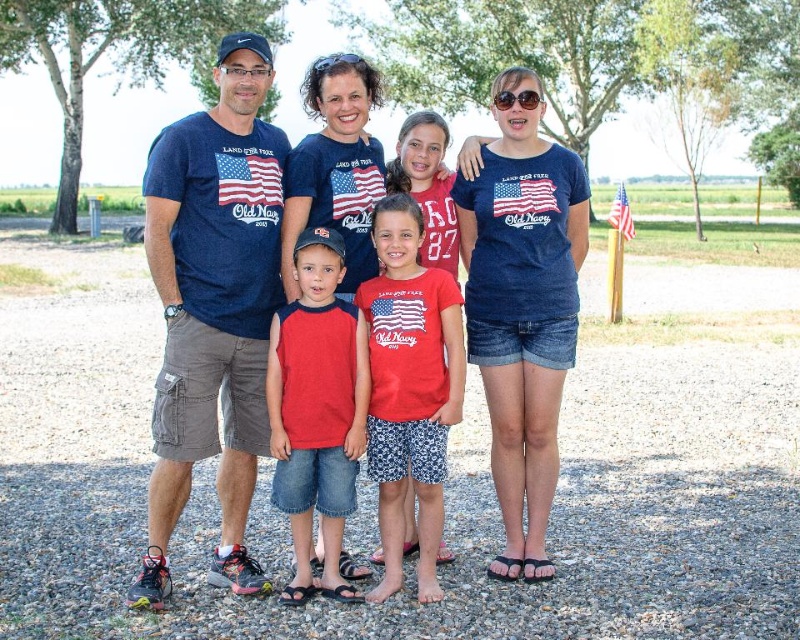
You are a photographer trying to capture a clear shot of the red cotton shirt at center and the american flag at center. Which object should you focus on first to ensure both are in focus?

The red cotton shirt at center is in front of the american flag at center, so you should focus on the red cotton shirt at center first to ensure both are in focus.